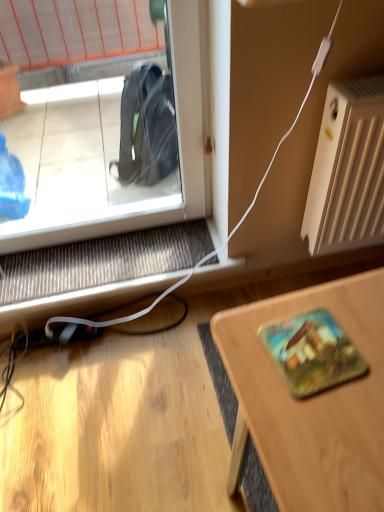
This screenshot has height=512, width=384. In order to click on free spot below white matte radiator at right (from a real-world perspective) in this screenshot , I will do `click(335, 267)`.